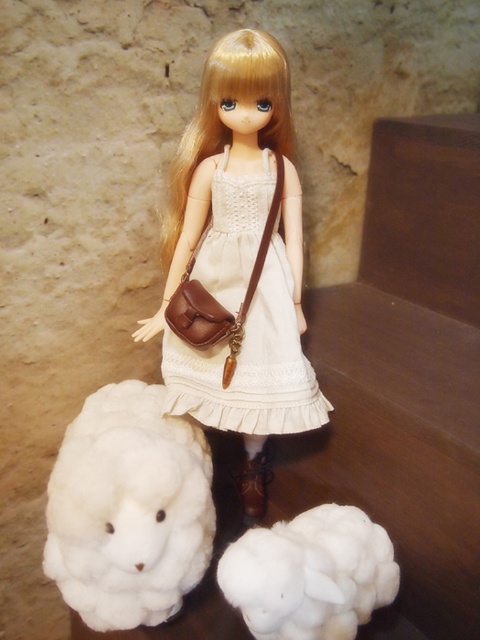
Question: Which point appears closest to the camera in this image?

Choices:
 (A) coord(50,477)
 (B) coord(183,412)
 (C) coord(264,365)

Answer: (A)

Question: Can you confirm if white lace dress at center is smaller than brown leather boot at lower center?

Choices:
 (A) yes
 (B) no

Answer: (B)

Question: Which of the following is the closest to the observer?

Choices:
 (A) (245, 218)
 (B) (243, 387)
 (C) (67, 452)

Answer: (C)

Question: Which of the following is the farthest from the observer?

Choices:
 (A) white fluffy sheep at lower left
 (B) matte brown purse at center

Answer: (B)

Question: Is matte brown purse at center further to the viewer compared to fluffy white lamb at lower left?

Choices:
 (A) yes
 (B) no

Answer: (A)

Question: Does matte brown purse at center appear on the right side of brown leather boot at lower center?

Choices:
 (A) no
 (B) yes

Answer: (A)